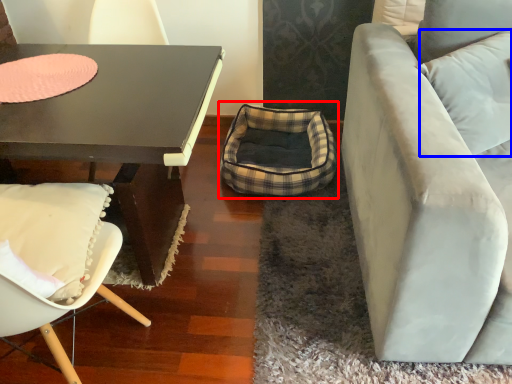
Question: Which of the following is the closest to the observer, bean bag chair (highlighted by a red box) or pillow (highlighted by a blue box)?

Choices:
 (A) bean bag chair
 (B) pillow

Answer: (B)